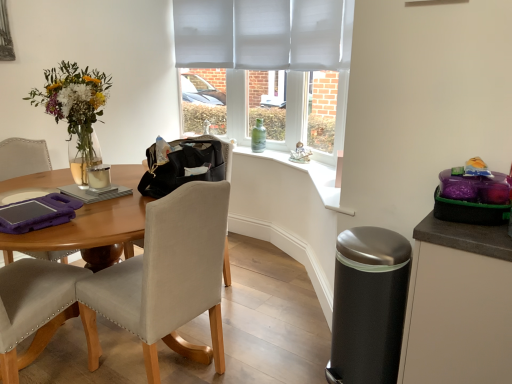
Image resolution: width=512 pixels, height=384 pixels. What do you see at coordinates (458, 305) in the screenshot? I see `matte black cabinet at right` at bounding box center [458, 305].

You are a GUI agent. You are given a task and a screenshot of the screen. Output one action in this format:
    pyautogui.click(x=<x>, y=<y>)
    Task: Click on the green glass bottle at window
    The image size is (512, 384).
    Given the screenshot: What is the action you would take?
    pyautogui.click(x=258, y=137)

Find the location of a particular element. This screenshot has height=384, width=512. black leather handbag at center is located at coordinates (182, 166).

Between beige fabric chair at left and matte white mug at table, which one is positioned behind?

matte white mug at table is behind.

Can you tell me how much beige fabric chair at left and matte white mug at table differ in facing direction?

The facing directions of beige fabric chair at left and matte white mug at table are 179 degrees apart.

From a real-world perspective, is beige fabric chair at left positioned over matte white mug at table based on gravity?

No.

Based on the photo, who is shorter, beige fabric chair at left or matte white mug at table?

With less height is matte white mug at table.

Is black leather handbag at center closer to camera compared to matte white mug at table?

Yes, black leather handbag at center is in front of matte white mug at table.

Is matte white mug at table surrounded by black leather handbag at center?

No, matte white mug at table is not surrounded by black leather handbag at center.

Measure the distance between black leather handbag at center and matte white mug at table.

black leather handbag at center is 13.21 inches away from matte white mug at table.

Is the surface of black leather handbag at center in direct contact with matte white mug at table?

black leather handbag at center is not next to matte white mug at table, and they're not touching.

I want to click on bottle above the matte black cabinet at right (from the image's perspective), so click(258, 137).

From the image's perspective, which is above, matte black cabinet at right or green glass bottle at window?

green glass bottle at window is shown above in the image.

Which is in front, point (472, 325) or point (261, 119)?

The point (472, 325) is in front.

There is a satin black trash can at lower right. Find the location of `coffee cup above it (from a real-world perspective)`. coffee cup above it (from a real-world perspective) is located at coordinates (99, 178).

Can you confirm if matte white mug at table is thinner than satin black trash can at lower right?

Yes.

Is matte white mug at table taller or shorter than satin black trash can at lower right?

In the image, matte white mug at table appears to be shorter than satin black trash can at lower right.

Who is smaller, matte white mug at table or satin black trash can at lower right?

Smaller between the two is matte white mug at table.

Is beige fabric chair at left in front of or behind green glass bottle at window in the image?

Clearly, beige fabric chair at left is in front of green glass bottle at window.

Based on the photo, from a real-world perspective, which object rests below the other?

beige fabric chair at left, from a real-world perspective.

Would you say beige fabric chair at left is outside green glass bottle at window?

Yes, beige fabric chair at left is not within green glass bottle at window.

From the image's perspective, is beige fabric chair at left positioned above or below green glass bottle at window?

Based on their image positions, beige fabric chair at left is located beneath green glass bottle at window.

In the scene shown: From the image's perspective, is green glass bottle at window located beneath black leather handbag at center?

No, from the image's perspective, green glass bottle at window is not beneath black leather handbag at center.

What's the angular difference between green glass bottle at window and black leather handbag at center's facing directions?

There is a 97.1-degree angle between the facing directions of green glass bottle at window and black leather handbag at center.

Looking at this image, considering the sizes of objects green glass bottle at window and black leather handbag at center in the image provided, who is taller, green glass bottle at window or black leather handbag at center?

With more height is green glass bottle at window.

Which is more to the left, green glass bottle at window or black leather handbag at center?

From the viewer's perspective, black leather handbag at center appears more on the left side.

Is beige fabric chair at left in contact with satin black trash can at lower right?

No, beige fabric chair at left is not with satin black trash can at lower right.

Between beige fabric chair at left and satin black trash can at lower right, which one is positioned in front?

Positioned in front is beige fabric chair at left.

Which of these two, beige fabric chair at left or satin black trash can at lower right, is bigger?

Bigger between the two is beige fabric chair at left.

The height and width of the screenshot is (384, 512). I want to click on chair located on the right of matte white mug at table, so click(x=166, y=278).

Where is `coffee cup behind the black leather handbag at center`? This screenshot has height=384, width=512. coffee cup behind the black leather handbag at center is located at coordinates (99, 178).

From the image, which object appears to be nearer to black leather handbag at center, green glass bottle at window or matte white mug at table?

matte white mug at table.

Based on their spatial positions, is black leather handbag at center or matte black cabinet at right further from satin black trash can at lower right?

Among the two, black leather handbag at center is located further to satin black trash can at lower right.

Looking at the image, which one is located closer to matte black cabinet at right, green glass bottle at window or black leather handbag at center?

Based on the image, black leather handbag at center appears to be nearer to matte black cabinet at right.

From the picture: From the image, which object appears to be nearer to matte black cabinet at right, matte white mug at table or beige fabric chair at left?

The object closer to matte black cabinet at right is beige fabric chair at left.

When comparing their distances from beige fabric chair at left, does satin black trash can at lower right or matte white mug at table seem closer?

matte white mug at table.

From the image, which object appears to be nearer to matte white mug at table, matte black cabinet at right or beige fabric chair at left?

The object closer to matte white mug at table is beige fabric chair at left.

When comparing their distances from black leather handbag at center, does matte black cabinet at right or green glass bottle at window seem further?

green glass bottle at window.

Considering their positions, is matte black cabinet at right positioned closer to satin black trash can at lower right than matte white mug at table?

matte black cabinet at right is closer to satin black trash can at lower right.

This screenshot has width=512, height=384. What are the coordinates of `coffee cup between black leather handbag at center and green glass bottle at window from front to back` in the screenshot? It's located at (99, 178).

You are a GUI agent. You are given a task and a screenshot of the screen. Output one action in this format:
    pyautogui.click(x=<x>, y=<y>)
    Task: Click on the chair between matte white mug at table and matte black cabinet at right
    This screenshot has width=512, height=384.
    Given the screenshot: What is the action you would take?
    pyautogui.click(x=166, y=278)

Image resolution: width=512 pixels, height=384 pixels. I want to click on trash bin/can between matte black cabinet at right and green glass bottle at window along the z-axis, so click(x=368, y=305).

At what (x,y) coordinates should I click in order to perform the action: click on handbag between beige fabric chair at left and matte black cabinet at right from left to right. Please return your answer as a coordinate pair (x, y). The height and width of the screenshot is (384, 512). Looking at the image, I should click on (182, 166).